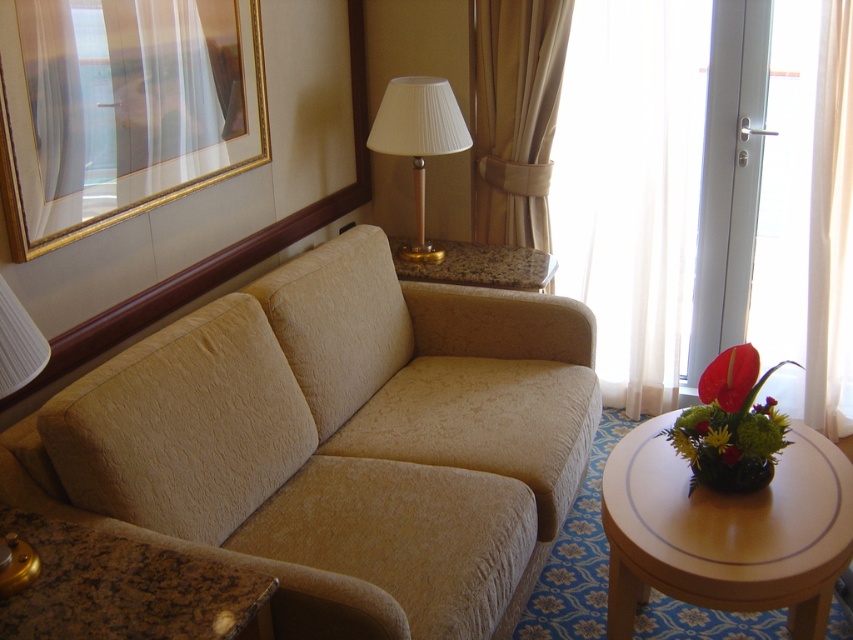
Who is more forward, (25,317) or (726,445)?

Positioned in front is point (25,317).

Where is `matte beige lamp at upper center`? This screenshot has width=853, height=640. matte beige lamp at upper center is located at coordinates (18, 342).

Is gold-framed picture at upper left smaller than beige satin curtain at upper right?

No.

Between gold-framed picture at upper left and beige satin curtain at upper right, which one appears on the right side from the viewer's perspective?

From the viewer's perspective, beige satin curtain at upper right appears more on the right side.

Is point (184, 0) farther from camera compared to point (488, 156)?

No, (184, 0) is closer to viewer.

At what (x,y) coordinates should I click in order to perform the action: click on gold-framed picture at upper left. Please return your answer as a coordinate pair (x, y). Image resolution: width=853 pixels, height=640 pixels. Looking at the image, I should click on (122, 108).

Is beige fabric couch at center further to camera compared to gold-framed picture at upper left?

No, beige fabric couch at center is closer to the viewer.

Does point (228, 560) lie in front of point (3, 150)?

Yes.

What do you see at coordinates (337, 442) in the screenshot? Image resolution: width=853 pixels, height=640 pixels. I see `beige fabric couch at center` at bounding box center [337, 442].

This screenshot has height=640, width=853. Identify the location of beige fabric couch at center. (337, 442).